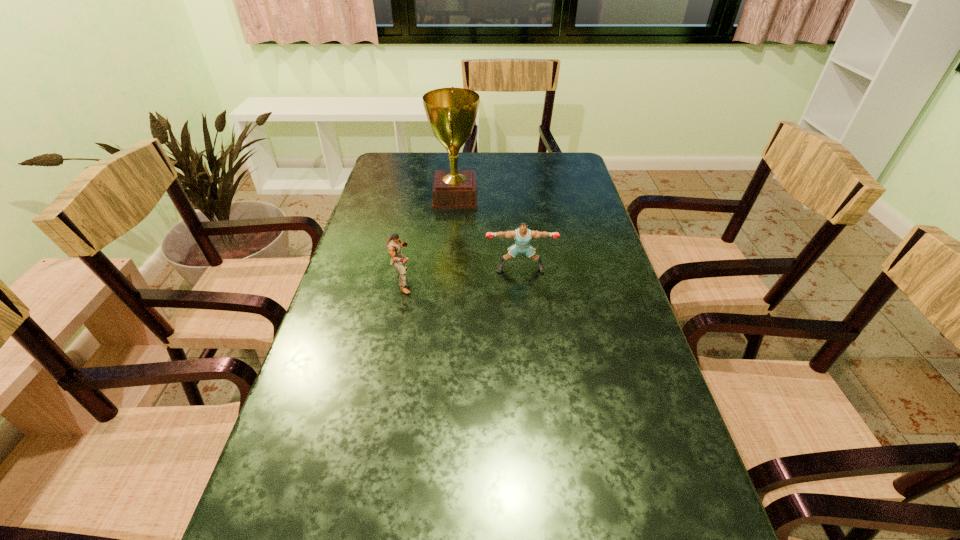
Image resolution: width=960 pixels, height=540 pixels. I want to click on the farthest object, so click(x=451, y=112).

Where is `the tallest object`? The width and height of the screenshot is (960, 540). the tallest object is located at coordinates (451, 112).

Where is `the left puncher`? The height and width of the screenshot is (540, 960). the left puncher is located at coordinates pyautogui.click(x=394, y=245).

The width and height of the screenshot is (960, 540). Find the location of `the rightmost object`. the rightmost object is located at coordinates click(x=522, y=236).

Where is `free space located 0.240m on the plaque of the award`? This screenshot has width=960, height=540. free space located 0.240m on the plaque of the award is located at coordinates pyautogui.click(x=552, y=197).

Find the location of a particular element. The height and width of the screenshot is (540, 960). vacant region located 0.090m on the front-facing side of the left puncher is located at coordinates (449, 280).

Identify the location of vacant space located on the front-facing side of the right puncher. (524, 302).

Identify the location of object located in the far edge section of the desktop. (x=451, y=112).

The width and height of the screenshot is (960, 540). Find the location of `object present at the left edge`. object present at the left edge is located at coordinates (394, 245).

This screenshot has width=960, height=540. In the image, there is a desktop. Identify the location of vacant space at the far edge. (489, 183).